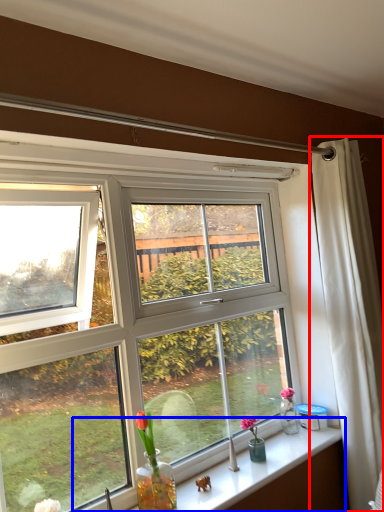
Question: Which of the following is the closest to the observer, curtain (highlighted by a red box) or window sill (highlighted by a blue box)?

Choices:
 (A) curtain
 (B) window sill

Answer: (B)